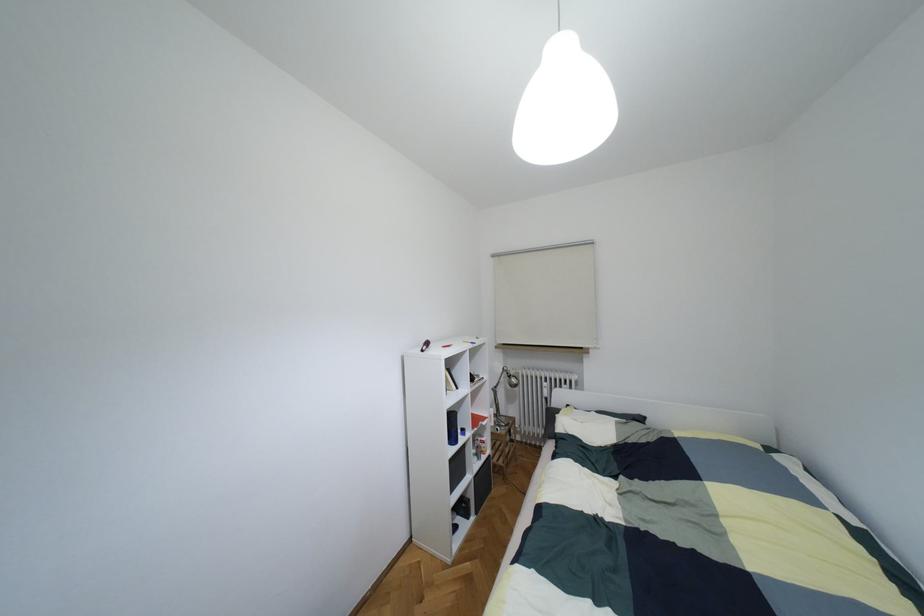
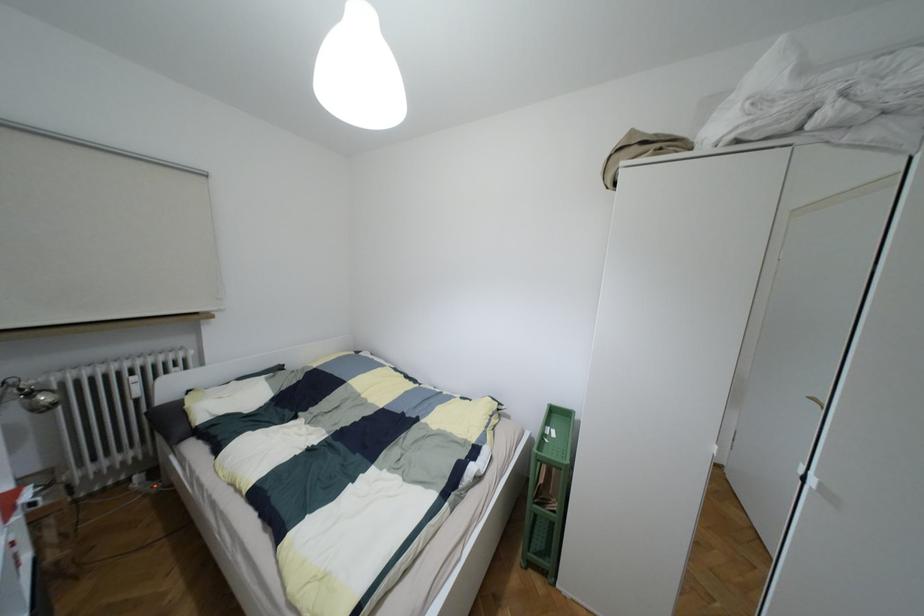
Question: How did the camera likely rotate?

Choices:
 (A) Left
 (B) Right
 (C) Up
 (D) Down

Answer: (B)